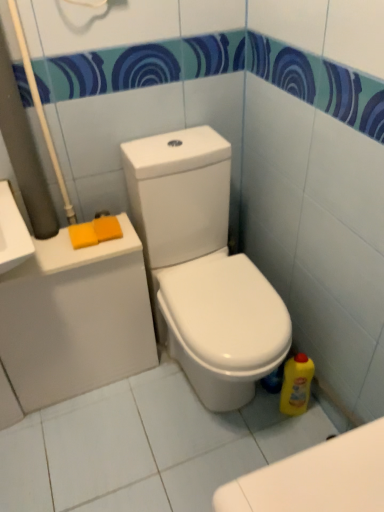
Where is `unoccupied area in front of orange sponge at upper left, which is the second soap in left-to-right order`? The image size is (384, 512). unoccupied area in front of orange sponge at upper left, which is the second soap in left-to-right order is located at coordinates (101, 251).